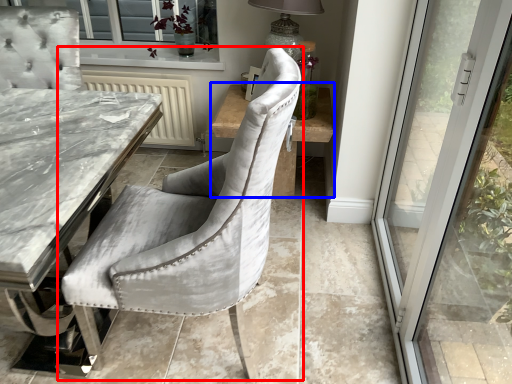
Question: Which point is closer to the camera, chair (highlighted by a red box) or side table (highlighted by a blue box)?

Choices:
 (A) chair
 (B) side table

Answer: (A)